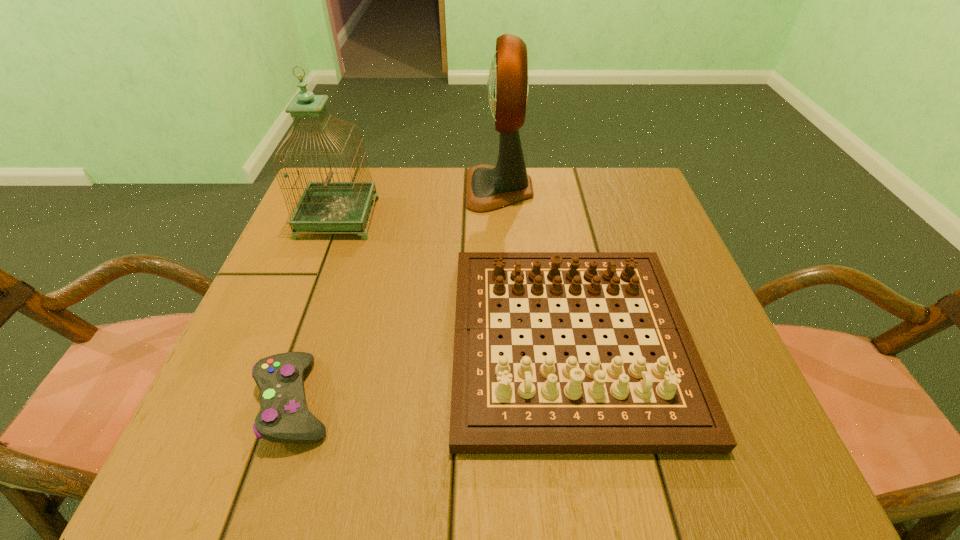
At what (x,y) coordinates should I click in order to perform the action: click on birdcage at the far edge. Please return your answer as a coordinate pair (x, y). Looking at the image, I should click on (324, 206).

This screenshot has height=540, width=960. I want to click on gameboard situated at the near edge, so click(x=555, y=404).

What are the coordinates of `control that is at the near edge` in the screenshot? It's located at (284, 417).

Image resolution: width=960 pixels, height=540 pixels. Find the location of `birdcage located in the left edge section of the desktop`. birdcage located in the left edge section of the desktop is located at coordinates (324, 206).

Identify the location of control that is positioned at the left edge. coord(284,417).

You are a GUI agent. You are given a task and a screenshot of the screen. Output one action in this format:
    pyautogui.click(x=<x>, y=<y>)
    Task: Click on the object that is at the right edge
    
    Given the screenshot: What is the action you would take?
    pyautogui.click(x=555, y=404)

This screenshot has width=960, height=540. I want to click on object located in the far left corner section of the desktop, so click(324, 206).

What are the coordinates of `object present at the near left corner` in the screenshot? It's located at (284, 417).

Find the location of a particular element. object that is at the near right corner is located at coordinates (555, 404).

Find the location of a particular element. Image resolution: width=960 pixels, height=540 pixels. free space at the far edge of the desktop is located at coordinates (386, 173).